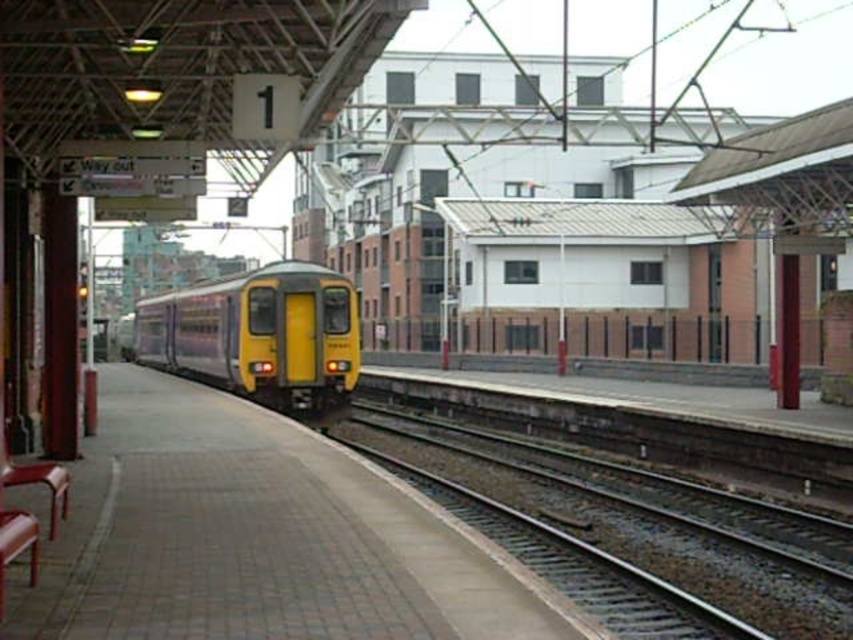
Question: Which object is positioned closest to the smooth concrete platform at center?

Choices:
 (A) yellow matte train at center
 (B) smooth metal track at center

Answer: (B)

Question: Is smooth metal track at center bigger than yellow matte train at center?

Choices:
 (A) yes
 (B) no

Answer: (B)

Question: Among these objects, which one is farthest from the camera?

Choices:
 (A) smooth metal track at center
 (B) smooth concrete platform at center

Answer: (A)

Question: Which point is farther to the camera?

Choices:
 (A) smooth concrete platform at center
 (B) smooth metal track at center
 (C) yellow matte train at center

Answer: (C)

Question: Is smooth metal track at center in front of yellow matte train at center?

Choices:
 (A) no
 (B) yes

Answer: (B)

Question: Is the position of smooth concrete platform at center less distant than that of smooth metal track at center?

Choices:
 (A) yes
 (B) no

Answer: (A)